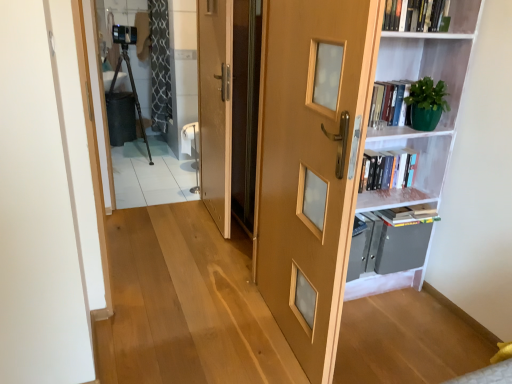
The width and height of the screenshot is (512, 384). Find the location of `vacant position to the left of wooden door at center, which is the second door from right to left`. vacant position to the left of wooden door at center, which is the second door from right to left is located at coordinates (159, 224).